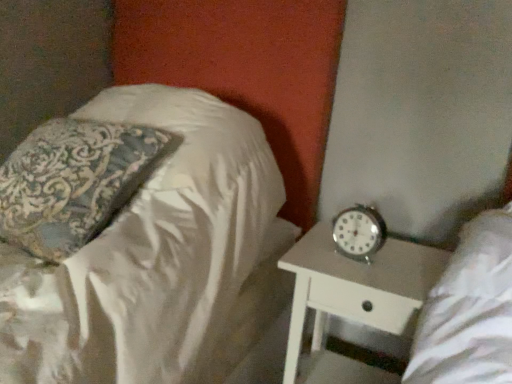
Locate an element on the screen. This screenshot has width=512, height=384. free space to the left of metallic silver clock at right is located at coordinates (319, 249).